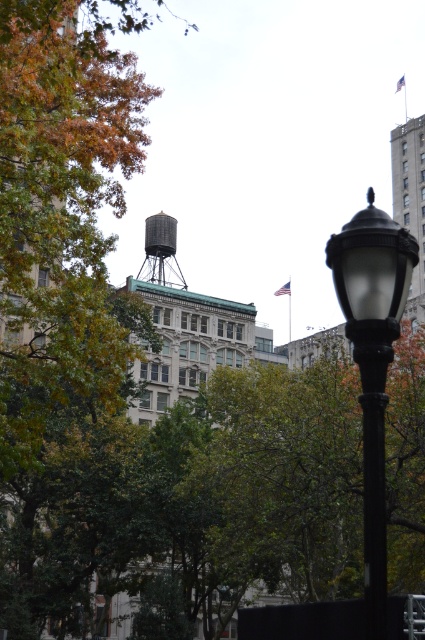
You are a delivery driver navigating through the city streets. You need to turn left at the intersection ahead. To ensure you turn correctly, you notice the black matte street light at center right and the metallic gray water tower at center. Which object should you use as a landmark to confirm your left turn direction?

You should use the black matte street light at center right as your landmark. Since it is positioned to the right of the metallic gray water tower at center, turning left would bring you closer to the water tower while keeping the street light on your right, indicating the correct turn direction.